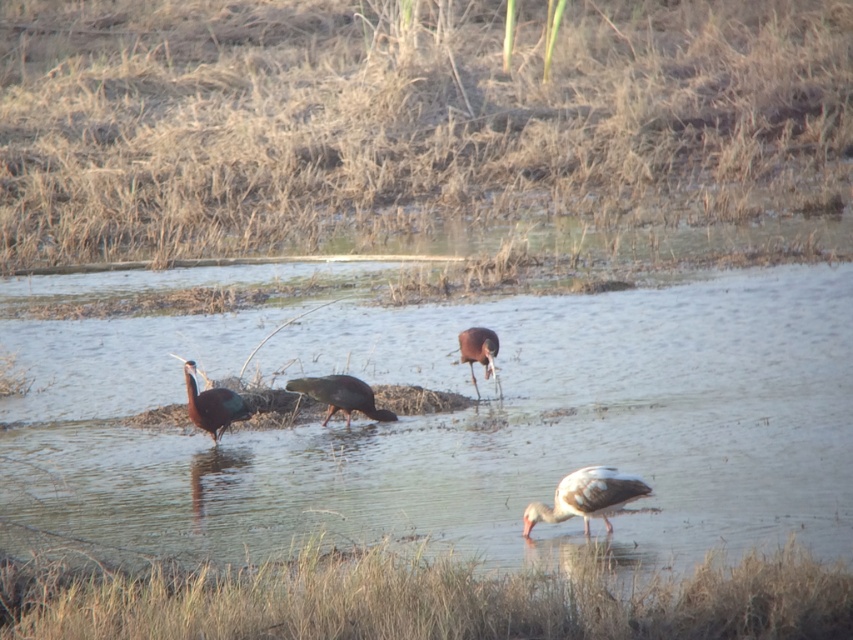
Who is lower down, brown grass at upper center or clear water at center?

clear water at center is lower down.

Is brown grass at upper center shorter than clear water at center?

In fact, brown grass at upper center may be taller than clear water at center.

Does point (341, 3) lie in front of point (294, 493)?

That is False.

Image resolution: width=853 pixels, height=640 pixels. I want to click on brown grass at upper center, so click(404, 116).

Can you confirm if clear water at center is bigger than shiny metallic bird at center?

Indeed, clear water at center has a larger size compared to shiny metallic bird at center.

How distant is clear water at center from shiny metallic bird at center?

clear water at center is 7.22 feet from shiny metallic bird at center.

What do you see at coordinates (451, 422) in the screenshot? The height and width of the screenshot is (640, 853). I see `clear water at center` at bounding box center [451, 422].

In order to click on clear water at center in this screenshot , I will do `click(451, 422)`.

Describe the element at coordinates (404, 116) in the screenshot. The width and height of the screenshot is (853, 640). I see `brown grass at upper center` at that location.

Which is in front, point (782, 8) or point (387, 413)?

Point (387, 413)

What do you see at coordinates (404, 116) in the screenshot?
I see `brown grass at upper center` at bounding box center [404, 116].

The height and width of the screenshot is (640, 853). Find the location of `brown grass at upper center`. brown grass at upper center is located at coordinates (404, 116).